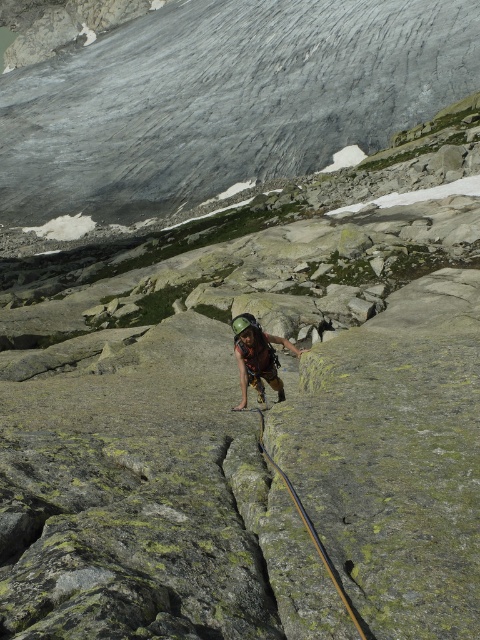
You are a mountain climber assessing the safest route up the mountain. You notice a specific point marked at coordinates point (223, 99). Based on the scene, where is this point located?

The point (223, 99) is located on gray rock at center.

You are a mountaineer planning to place a safety anchor between the gray rock at center and the matte brown helmet at center. Given that the distance between them is 534.20 feet, would you consider this distance safe for a single anchor point?

The gray rock at center is 534.20 feet from the matte brown helmet at center. This distance is too great for a single anchor point, as standard safety protocols recommend anchors within 100 feet of each other to ensure stability and reduce slack in the rope.